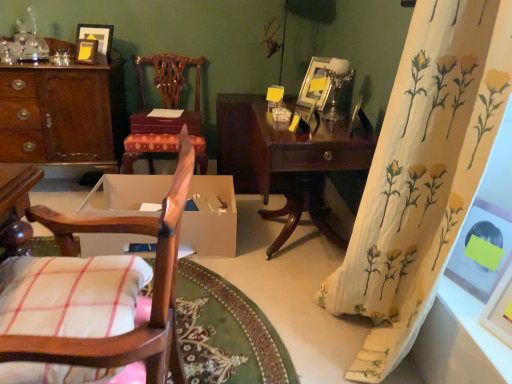
Question: From a real-world perspective, is white cotton pillow at lower left above or below wooden desk at left?

Choices:
 (A) above
 (B) below

Answer: (A)

Question: In the image, is white cotton pillow at lower left on the left side or the right side of wooden desk at left?

Choices:
 (A) left
 (B) right

Answer: (B)

Question: Which is farther from the wooden picture frame at upper left, which is the 2th picture frame from top to bottom?

Choices:
 (A) wooden desk at left
 (B) wooden chair with carved backrest at center, marked as the second chair in a bottom-to-top arrangement
 (C) metallic silver picture frame at upper right, which appears as the third picture frame when viewed from the right
 (D) matte yellow picture frame at upper left, which is counted as the first picture frame, starting from the back
 (E) metallic silver table lamp at upper right

Answer: (E)

Question: Which object is the closest to the matte white picture frame at right, marked as the first picture frame in a front-to-back arrangement?

Choices:
 (A) wooden chair with checkered cushion at left, positioned as the 2th chair in top-to-bottom order
 (B) mahogany wood table at center
 (C) metallic silver table lamp at upper right
 (D) matte yellow picture frame at upper left, the 5th picture frame positioned from the right
 (E) white cotton pillow at lower left

Answer: (A)